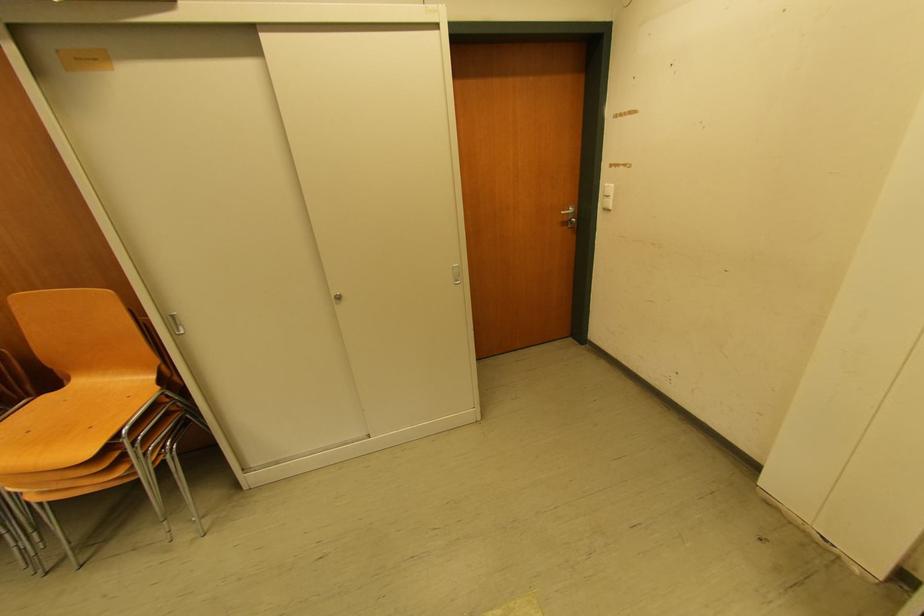
In order to click on white light switch in this screenshot , I will do (x=606, y=197).